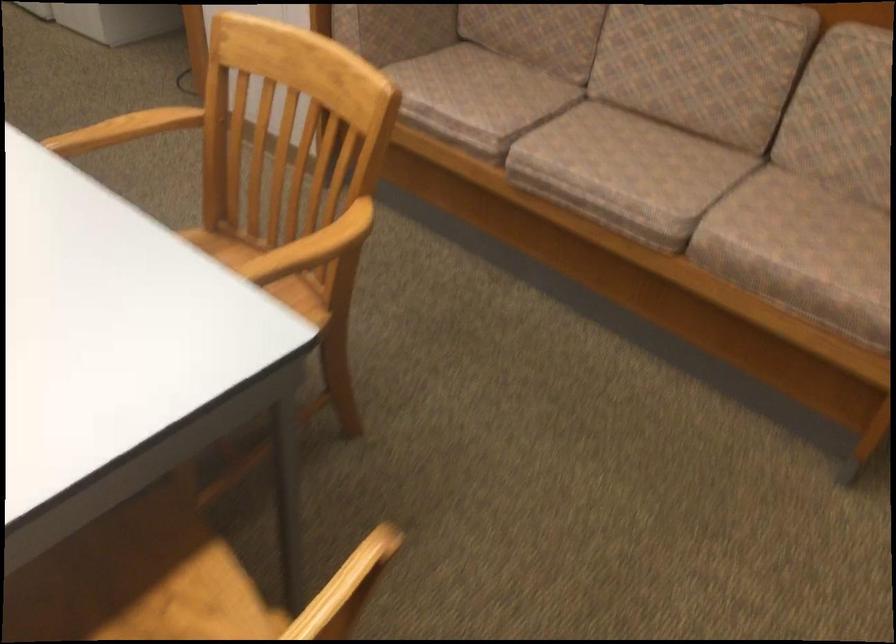
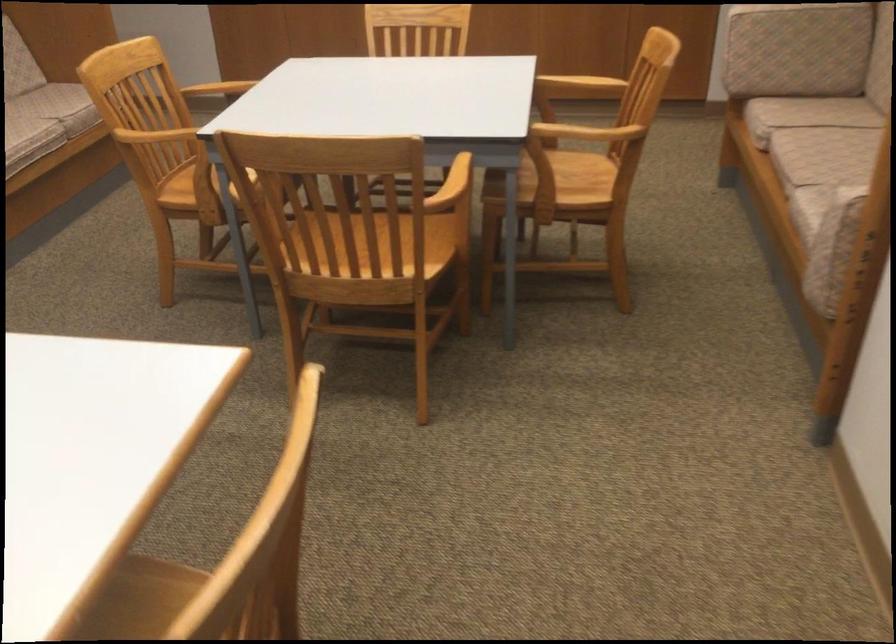
Find the pixel in the second image that matches pixel 767 221 in the first image.

(58, 106)